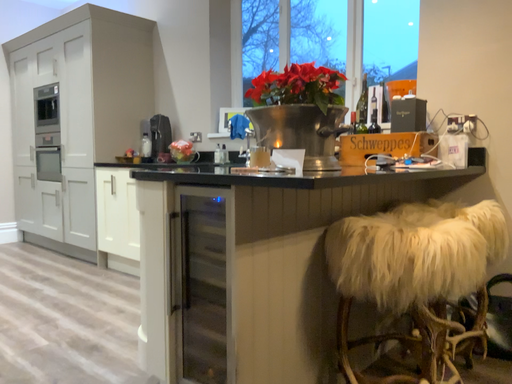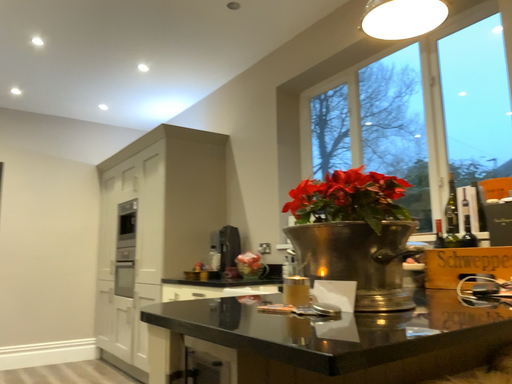
Question: How did the camera likely rotate when shooting the video?

Choices:
 (A) rotated left
 (B) rotated right

Answer: (A)